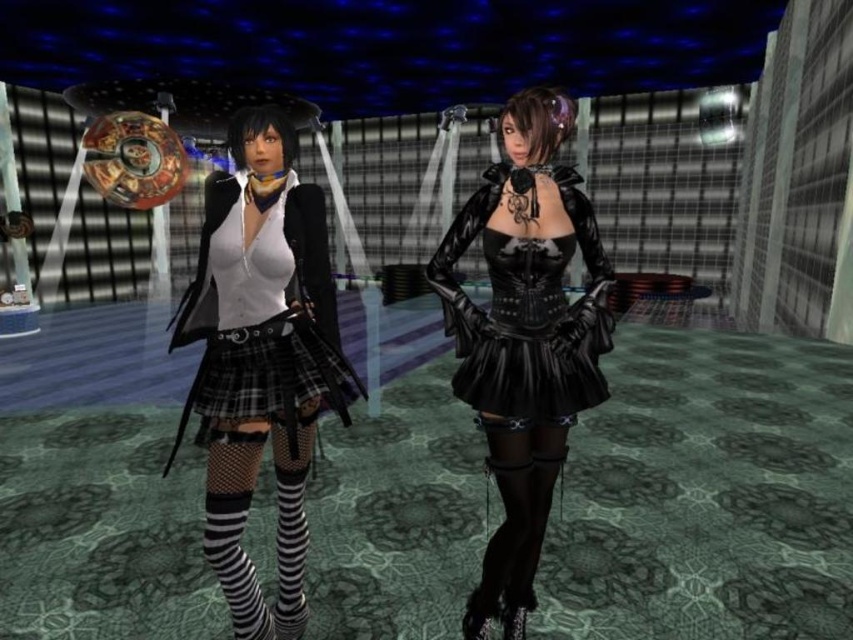
What do you see at coordinates (526, 308) in the screenshot?
I see `black leather dress at center` at bounding box center [526, 308].

Who is higher up, black leather dress at center or black leather thigh-high boots at lower center?

black leather dress at center is above.

Identify the location of black leather dress at center. (526, 308).

Between plaid skirt at center and black leather thigh-high boots at lower center, which one has less height?

black leather thigh-high boots at lower center

The height and width of the screenshot is (640, 853). What do you see at coordinates (260, 358) in the screenshot?
I see `plaid skirt at center` at bounding box center [260, 358].

Which is in front, point (328, 298) or point (485, 616)?

Point (328, 298) is more forward.

The height and width of the screenshot is (640, 853). In order to click on plaid skirt at center in this screenshot , I will do `click(260, 358)`.

Which is below, shiny black leather dress at center or black leather thigh-high boots at lower center?

black leather thigh-high boots at lower center

This screenshot has height=640, width=853. What do you see at coordinates (524, 339) in the screenshot?
I see `shiny black leather dress at center` at bounding box center [524, 339].

Who is more forward, (461, 380) or (482, 424)?

Point (482, 424) is more forward.

Where is `shiny black leather dress at center`? Image resolution: width=853 pixels, height=640 pixels. shiny black leather dress at center is located at coordinates (524, 339).